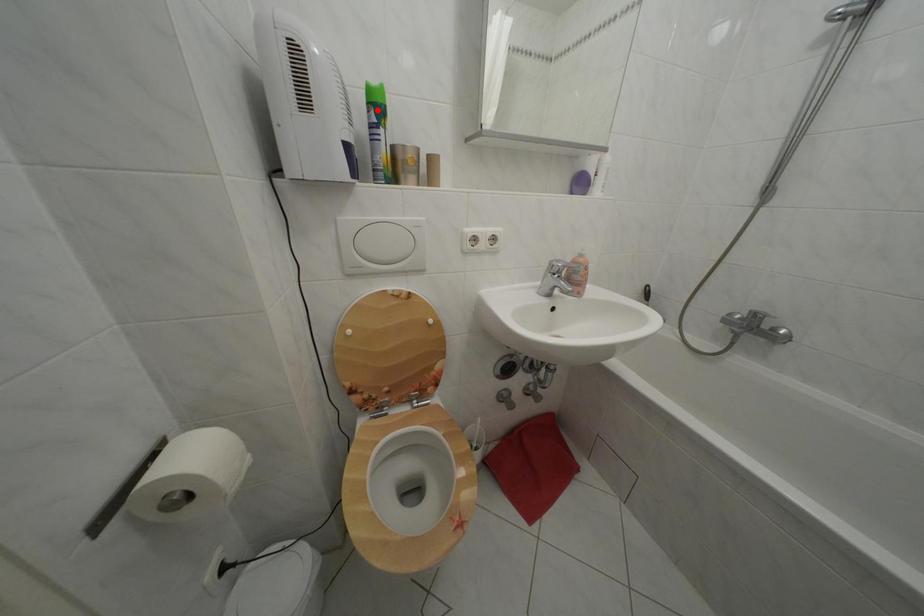
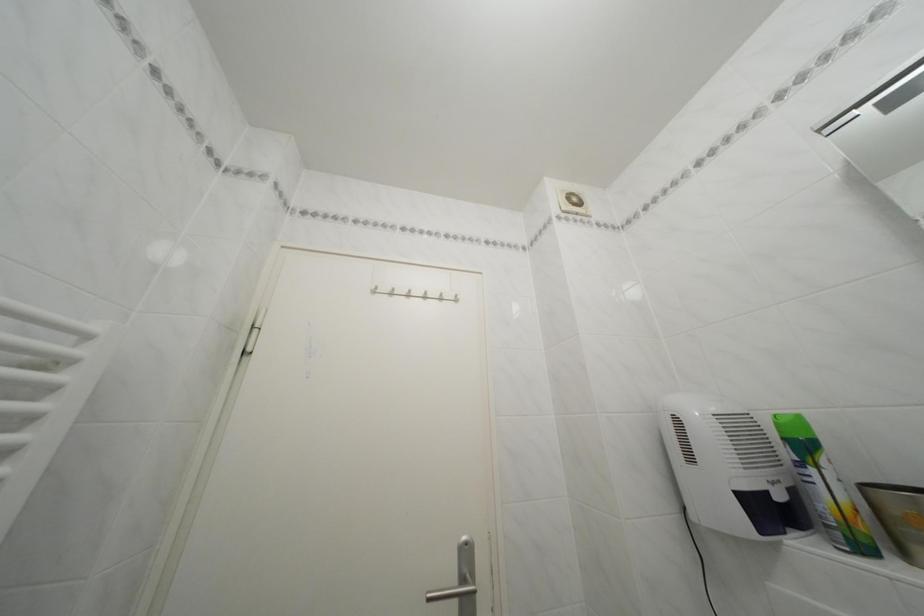
The point at the highlighted location is marked in the first image. Where is the corresponding point in the second image?

(793, 445)